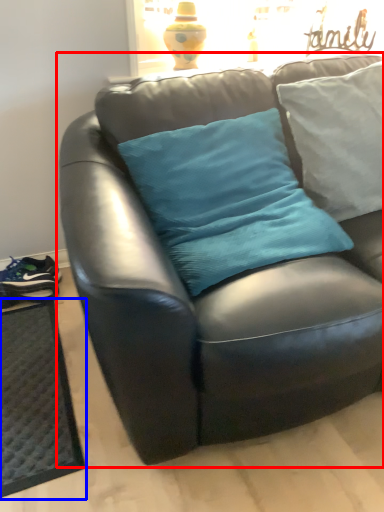
Question: Which object appears farthest to the camera in this image, studio couch (highlighted by a red box) or doormat (highlighted by a blue box)?

Choices:
 (A) studio couch
 (B) doormat

Answer: (B)